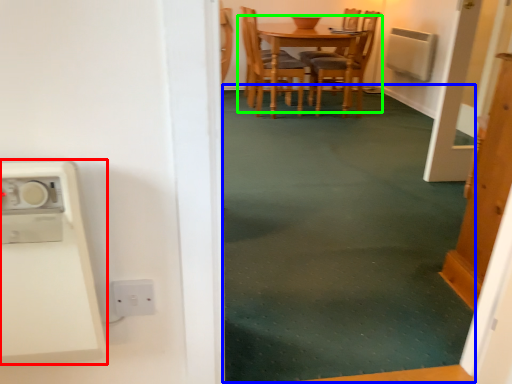
Question: Estimate the real-world distances between objects in this image. Which object is farther from appliance (highlighted by a red box), plain (highlighted by a blue box) or kitchen & dining room table (highlighted by a green box)?

Choices:
 (A) plain
 (B) kitchen & dining room table

Answer: (B)